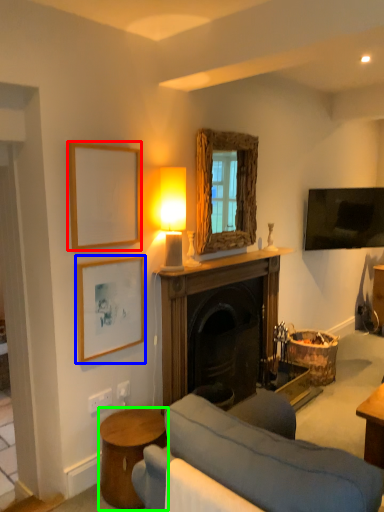
Question: Based on their relative distances, which object is farther from picture frame (highlighted by a red box)? Choose from picture frame (highlighted by a blue box) and table (highlighted by a green box).

Choices:
 (A) picture frame
 (B) table

Answer: (B)